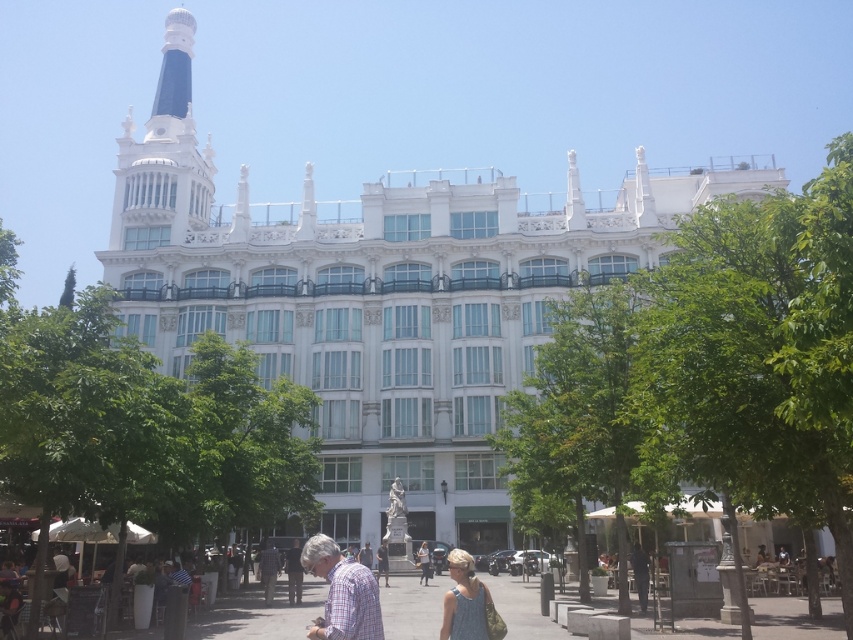
In the scene shown: You are standing in front of the grand building and want to take a photo. There are two points marked on your camera screen at coordinates point (294, 563) and point (364, 561). Which point should you focus on to ensure it appears clearer in the photo?

You should focus on point (294, 563) because it is closer to the camera and will appear clearer in the photo than point (364, 561).

You are standing in front of the grand building and notice two people wearing a dark brown leather jacket at lower center and a dark blue shirt at center. Which person is closer to the base of the building?

The dark brown leather jacket at lower center is positioned under the dark blue shirt at center, so the dark brown leather jacket at lower center is closer to the base of the building.

You are observing a crowd in front of a classical building. You notice two people wearing a checkered fabric shirt at center and a light gray fabric jacket at center. Which person is standing to the right of the other?

The checkered fabric shirt at center is positioned on the right side of light gray fabric jacket at center, so the person wearing the checkered fabric shirt at center is standing to the right of the person wearing the light gray fabric jacket at center.